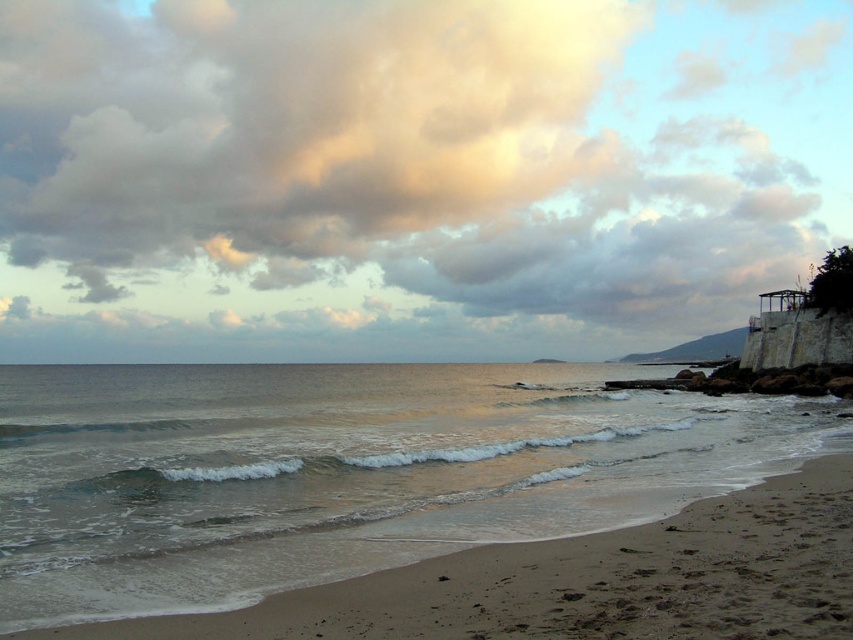
Does cloudy sky at upper center have a smaller size compared to sandy beach at lower left?

Actually, cloudy sky at upper center might be larger than sandy beach at lower left.

Who is more forward, (224, 269) or (424, 614)?

Positioned in front is point (424, 614).

Does point (438, 116) come in front of point (741, 589)?

That is False.

At what (x,y) coordinates should I click in order to perform the action: click on cloudy sky at upper center. Please return your answer as a coordinate pair (x, y). This screenshot has width=853, height=640. Looking at the image, I should click on (421, 156).